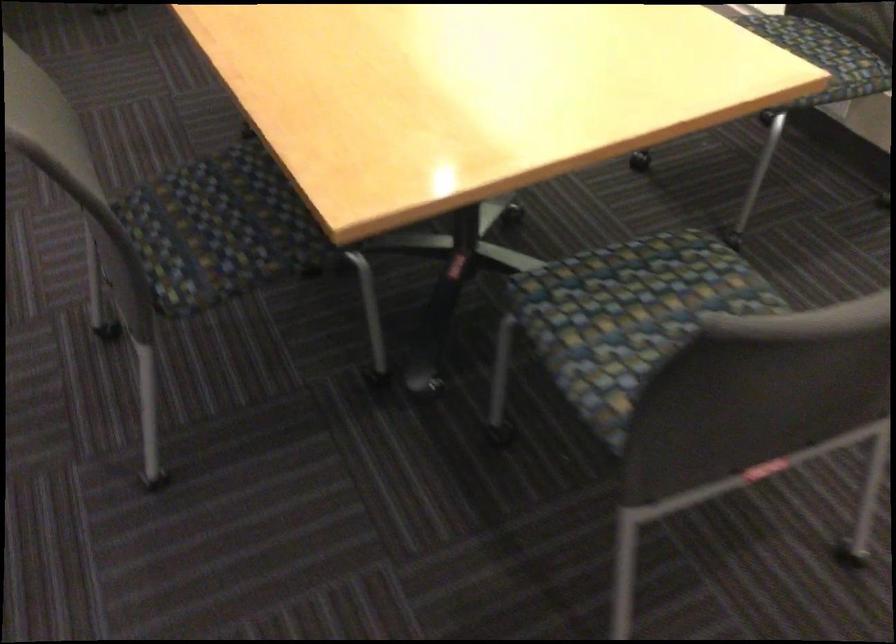
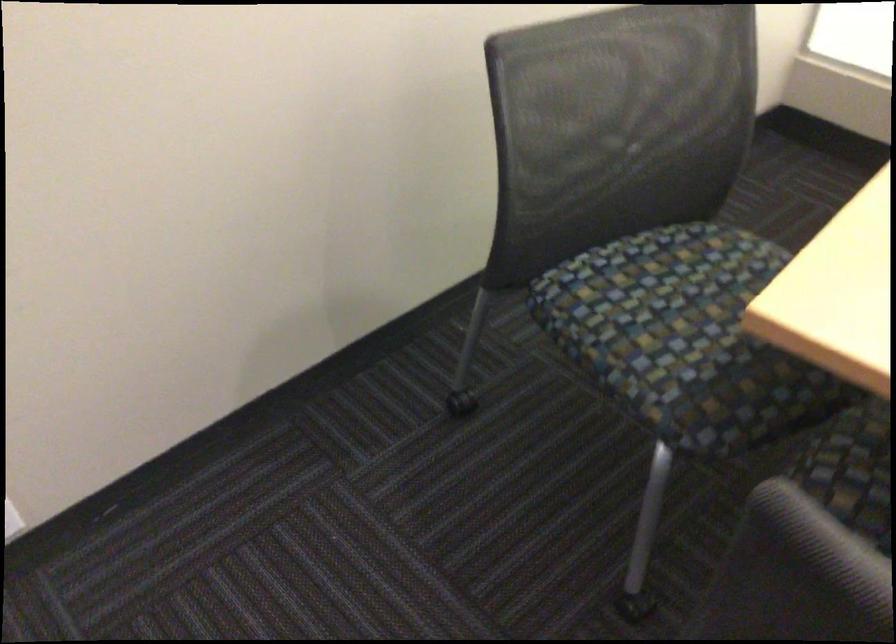
In a continuous first-person perspective shot, in which direction is the camera moving?

The cameraman moved toward left, forward.